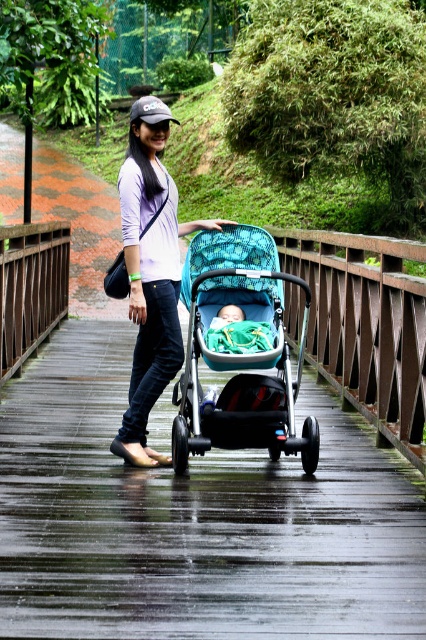
Who is lower down, matte white shirt at center or soft green fabric baby at center?

Positioned lower is soft green fabric baby at center.

Between matte white shirt at center and soft green fabric baby at center, which one is positioned higher?

matte white shirt at center is higher up.

Is point (158, 268) closer to camera compared to point (224, 308)?

Yes, point (158, 268) is in front of point (224, 308).

Find the location of `matte white shirt at center`. matte white shirt at center is located at coordinates (150, 273).

Is shiny black stroller at center bigger than soft green fabric baby at center?

Correct, shiny black stroller at center is larger in size than soft green fabric baby at center.

Does shiny black stroller at center come in front of soft green fabric baby at center?

Yes.

This screenshot has width=426, height=640. What do you see at coordinates (195, 518) in the screenshot?
I see `shiny black stroller at center` at bounding box center [195, 518].

You are a GUI agent. You are given a task and a screenshot of the screen. Output one action in this format:
    pyautogui.click(x=<x>, y=<y>)
    Task: Click on the shiny black stroller at center
    
    Given the screenshot: What is the action you would take?
    pyautogui.click(x=195, y=518)

Between shiny black stroller at center and teal fabric stroller at center, which one has less height?

Standing shorter between the two is shiny black stroller at center.

Which is above, shiny black stroller at center or teal fabric stroller at center?

teal fabric stroller at center is higher up.

Locate an element on the screen. The image size is (426, 640). shiny black stroller at center is located at coordinates (195, 518).